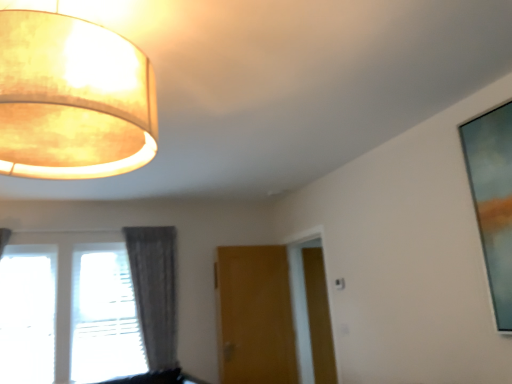
Question: Can you confirm if brown wood screen door at center is taller than transparent glass window at lower left?

Choices:
 (A) yes
 (B) no

Answer: (A)

Question: From a real-world perspective, does brown wood screen door at center stand above transparent glass window at lower left?

Choices:
 (A) yes
 (B) no

Answer: (B)

Question: Can you confirm if brown wood screen door at center is wider than transparent glass window at lower left?

Choices:
 (A) no
 (B) yes

Answer: (A)

Question: Does brown wood screen door at center have a lesser height compared to transparent glass window at lower left?

Choices:
 (A) yes
 (B) no

Answer: (B)

Question: Is brown wood screen door at center oriented towards transparent glass window at lower left?

Choices:
 (A) no
 (B) yes

Answer: (A)

Question: From the image's perspective, relative to transparent glass window at lower left, is wooden door at center above or below?

Choices:
 (A) above
 (B) below

Answer: (B)

Question: Does point (227, 334) appear closer or farther from the camera than point (86, 286)?

Choices:
 (A) farther
 (B) closer

Answer: (A)

Question: Is wooden door at center taller or shorter than transparent glass window at lower left?

Choices:
 (A) tall
 (B) short

Answer: (A)

Question: Is wooden door at center wider or thinner than transparent glass window at lower left?

Choices:
 (A) thin
 (B) wide

Answer: (A)

Question: Considering the positions of glassy blue painting at upper right and wooden door at center in the image, is glassy blue painting at upper right wider or thinner than wooden door at center?

Choices:
 (A) thin
 (B) wide

Answer: (A)

Question: Would you say glassy blue painting at upper right is to the left or to the right of wooden door at center in the picture?

Choices:
 (A) left
 (B) right

Answer: (B)

Question: From a real-world perspective, is glassy blue painting at upper right physically located above or below wooden door at center?

Choices:
 (A) below
 (B) above

Answer: (B)

Question: Which is correct: glassy blue painting at upper right is inside wooden door at center, or outside of it?

Choices:
 (A) inside
 (B) outside

Answer: (B)

Question: From a real-world perspective, is wooden door at center positioned above or below glassy blue painting at upper right?

Choices:
 (A) above
 (B) below

Answer: (B)

Question: Looking at their shapes, would you say wooden door at center is wider or thinner than glassy blue painting at upper right?

Choices:
 (A) wide
 (B) thin

Answer: (A)